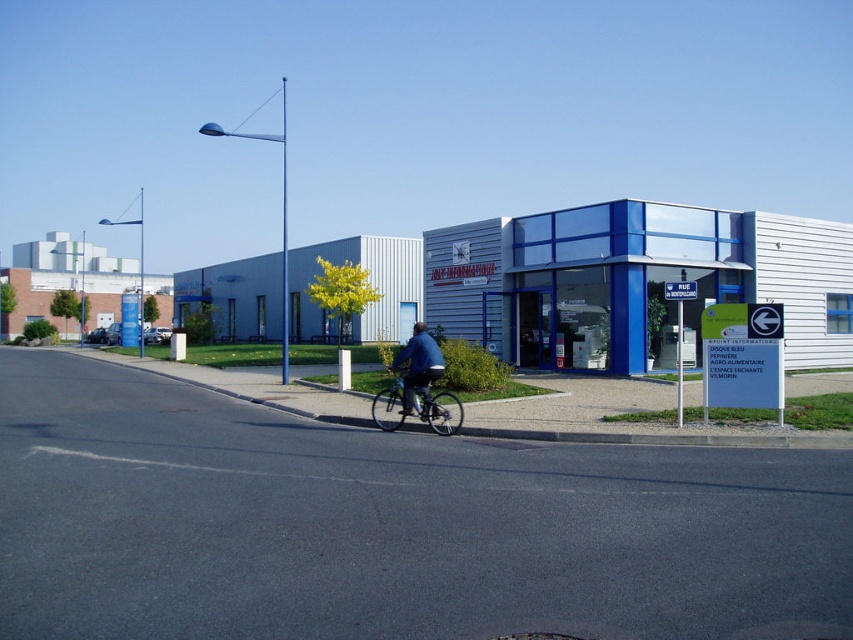
Is metallic silver bicycle at center below blue denim jacket at center?

Indeed, metallic silver bicycle at center is positioned under blue denim jacket at center.

Does point (415, 392) come farther from viewer compared to point (404, 416)?

No, (415, 392) is closer to viewer.

I want to click on metallic silver bicycle at center, so click(x=437, y=410).